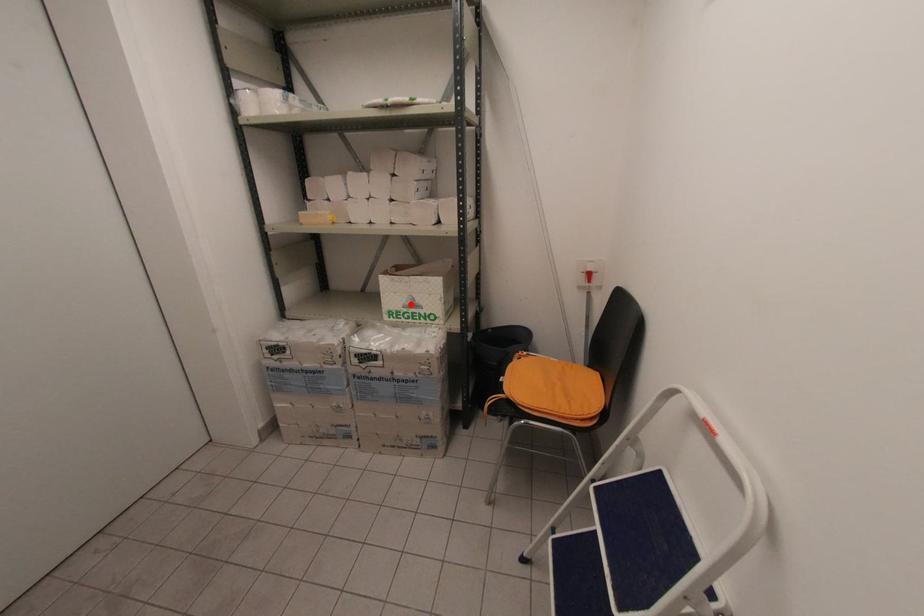
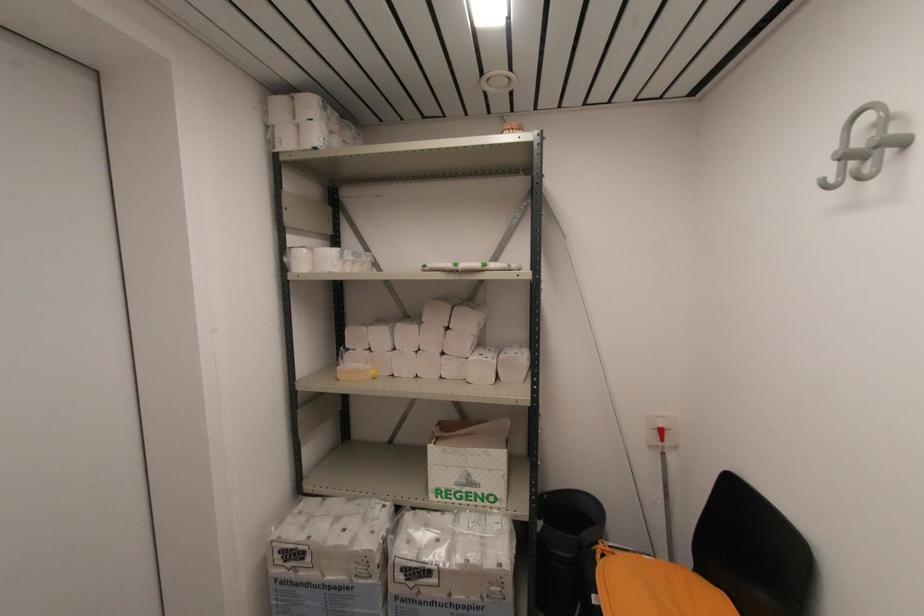
Question: I am providing you with two images of the same scene from different viewpoints. Given a red point in image1, look at the same physical point in image2. Is it:

Choices:
 (A) Closer to the viewpoint
 (B) Farther from the viewpoint

Answer: (B)